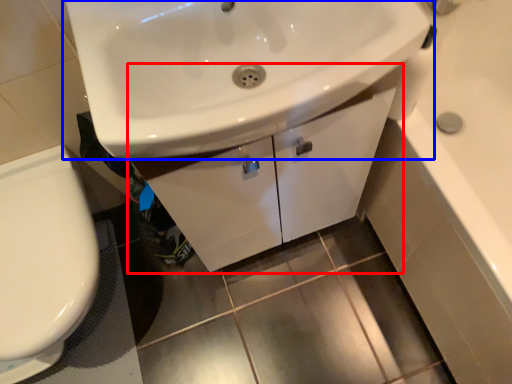
Question: Which object appears closest to the camera in this image, bathroom cabinet (highlighted by a red box) or sink (highlighted by a blue box)?

Choices:
 (A) bathroom cabinet
 (B) sink

Answer: (B)